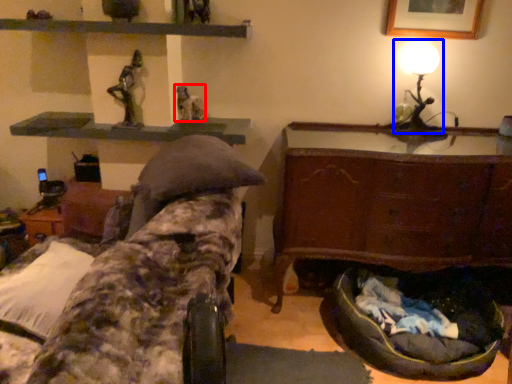
Question: Which object appears closest to the camera in this image, sculpture (highlighted by a red box) or table lamp (highlighted by a blue box)?

Choices:
 (A) sculpture
 (B) table lamp

Answer: (B)